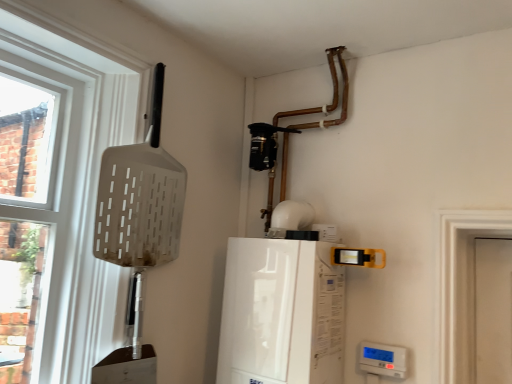
Question: Considering the positions of white glossy boiler at center, arranged as the second appliance when viewed from the right, and white plastic thermostat at lower right, which is the 2th appliance from top to bottom, in the image, is white glossy boiler at center, arranged as the second appliance when viewed from the right, wider or thinner than white plastic thermostat at lower right, which is the 2th appliance from top to bottom,?

Choices:
 (A) thin
 (B) wide

Answer: (B)

Question: From a real-world perspective, relative to white plastic thermostat at lower right, which appears as the first appliance when ordered from the bottom, is white glossy boiler at center, which appears as the first appliance when viewed from the left, vertically above or below?

Choices:
 (A) above
 (B) below

Answer: (A)

Question: Which object is positioned closest to the white glossy boiler at center, which appears as the first appliance when viewed from the left?

Choices:
 (A) white plastic thermostat at lower right, the first appliance in the right-to-left sequence
 (B) white plastic shovel at left

Answer: (A)

Question: Estimate the real-world distances between objects in this image. Which object is farther from the white plastic shovel at left?

Choices:
 (A) white plastic thermostat at lower right, the first appliance in the right-to-left sequence
 (B) white glossy boiler at center, the first appliance when ordered from top to bottom

Answer: (A)